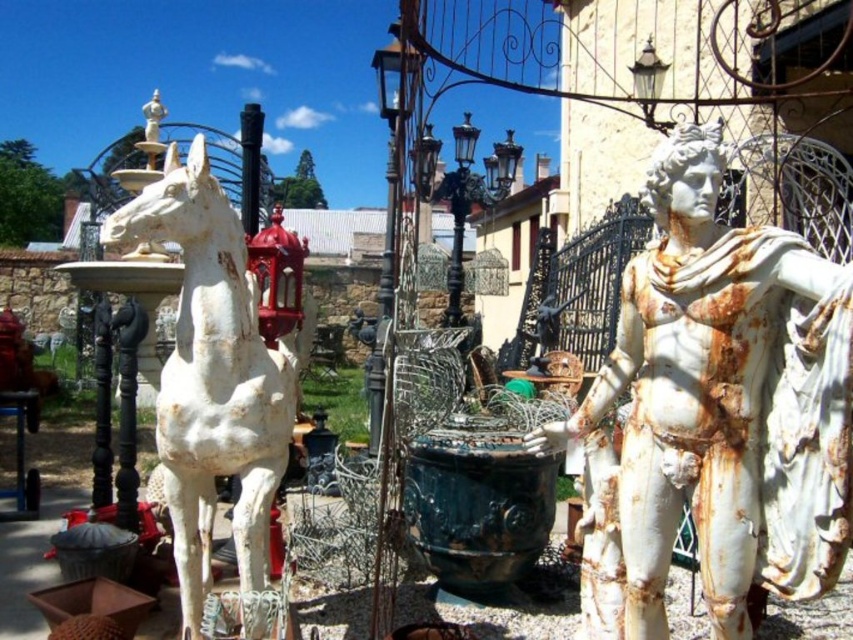
Is white marble statue at center thinner than white matte horse at left?

In fact, white marble statue at center might be wider than white matte horse at left.

Who is more forward, (x=705, y=129) or (x=215, y=291)?

Point (x=705, y=129) is in front.

The width and height of the screenshot is (853, 640). What are the coordinates of `white marble statue at center` in the screenshot? It's located at (715, 412).